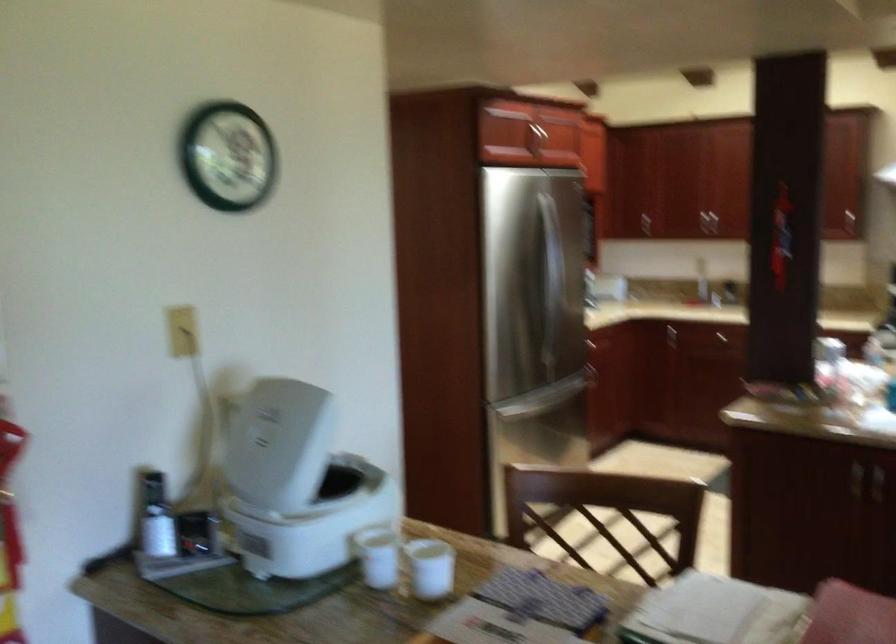
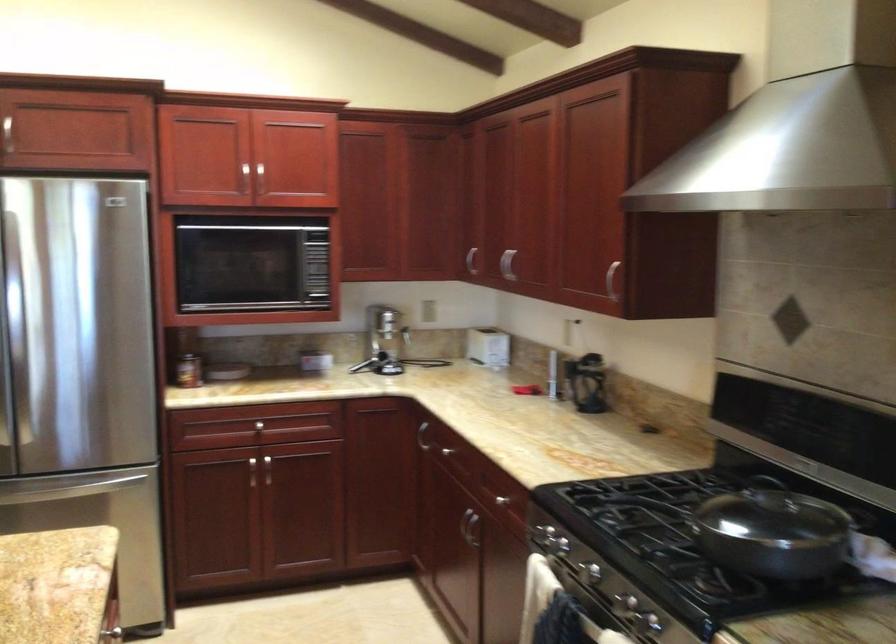
The point at (686,203) is marked in the first image. Where is the corresponding point in the second image?

(506, 263)